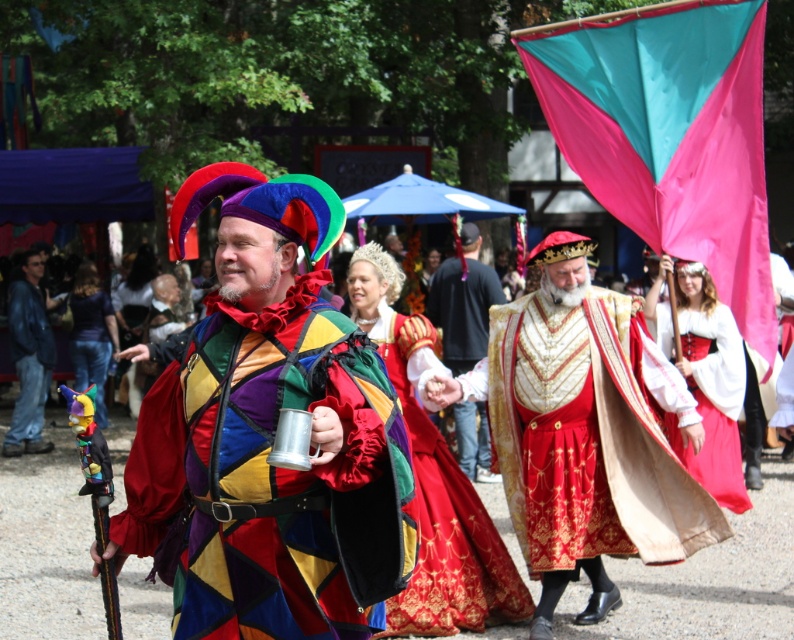
What is located at the coordinates point (445, 522)?

The velvet red dress at center is located at point (445, 522).